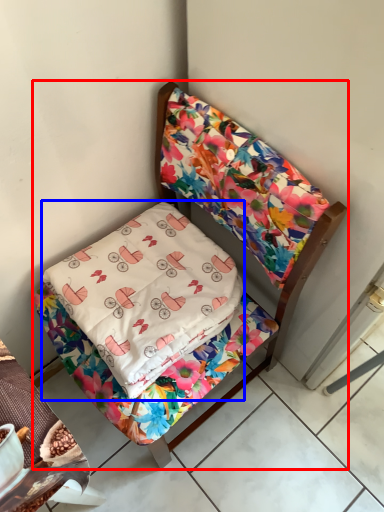
Question: Which object appears farthest to the camera in this image, furniture (highlighted by a red box) or pillow (highlighted by a blue box)?

Choices:
 (A) furniture
 (B) pillow

Answer: (B)